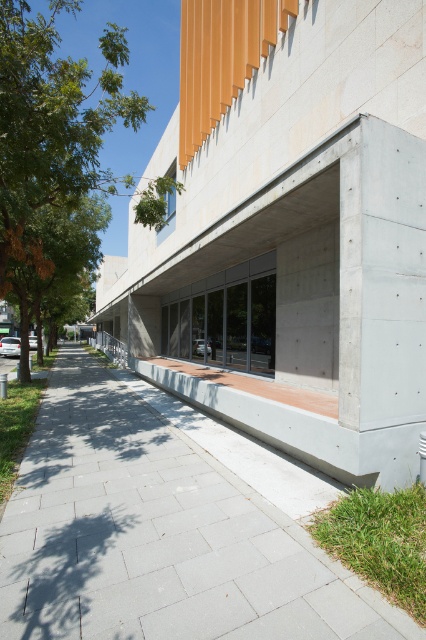
Question: Which point is farther to the camera?

Choices:
 (A) (134, 92)
 (B) (187, 611)

Answer: (A)

Question: Where is gray concrete pavement at center located in relation to green leafy tree at upper left in the image?

Choices:
 (A) right
 (B) left

Answer: (A)

Question: Does gray concrete pavement at center have a greater width compared to green leafy tree at upper left?

Choices:
 (A) yes
 (B) no

Answer: (B)

Question: Which point appears farthest from the camera in this image?

Choices:
 (A) [29, 166]
 (B) [354, 600]

Answer: (A)

Question: Can you confirm if gray concrete pavement at center is bigger than green leafy tree at upper left?

Choices:
 (A) no
 (B) yes

Answer: (A)